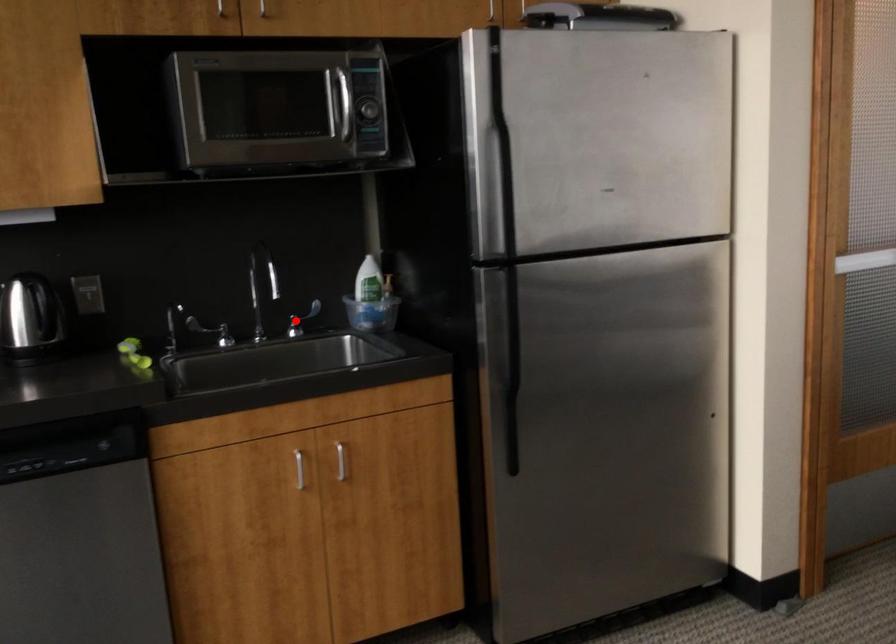
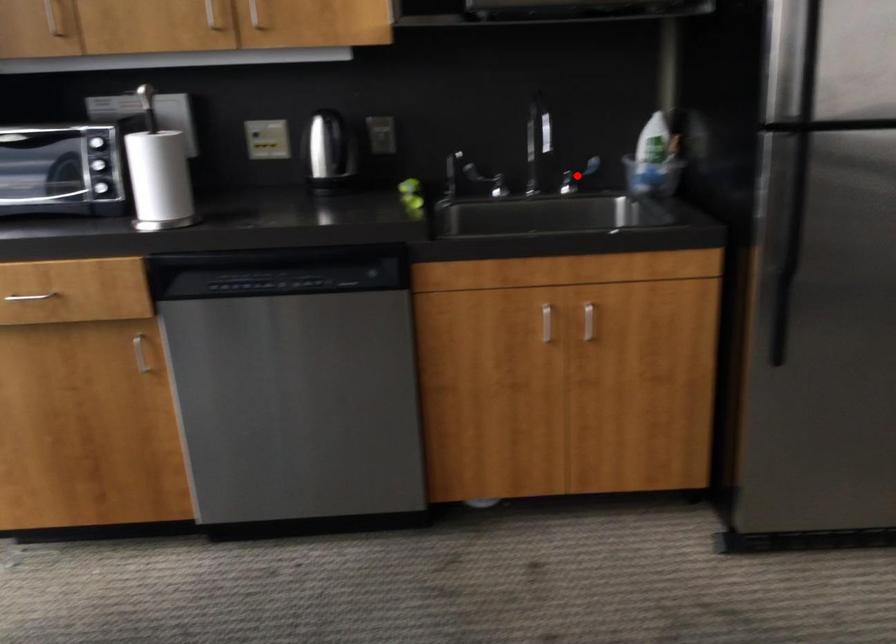
I am providing you with two images of the same scene from different viewpoints. A red point is marked on the first image and another point is marked on the second image. Does the point marked in image1 correspond to the same location as the one in image2?

Yes